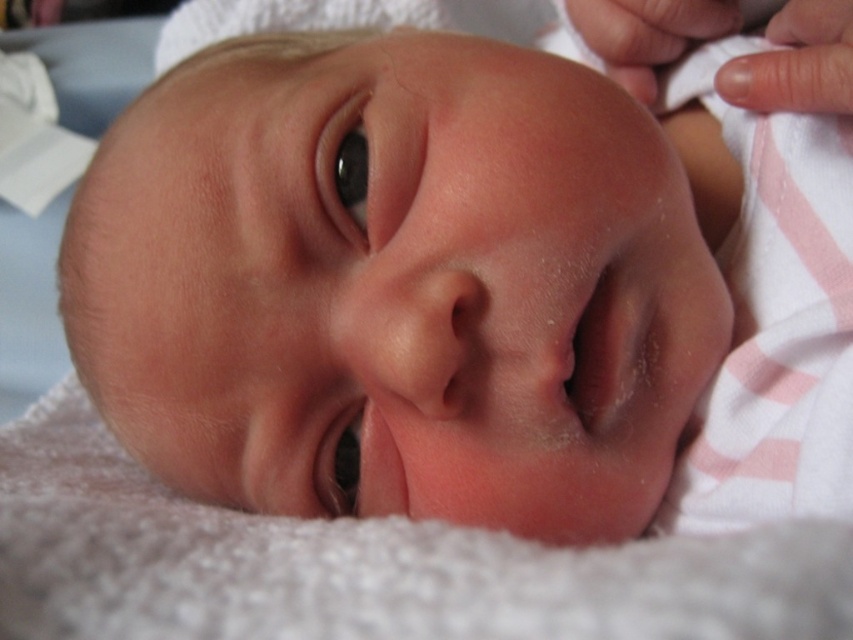
Can you confirm if black glossy eye at upper left is positioned to the left of black smooth eye at center?

In fact, black glossy eye at upper left is to the right of black smooth eye at center.

Can you confirm if black glossy eye at upper left is smaller than black smooth eye at center?

No.

The width and height of the screenshot is (853, 640). What do you see at coordinates (345, 168) in the screenshot?
I see `black glossy eye at upper left` at bounding box center [345, 168].

At what (x,y) coordinates should I click in order to perform the action: click on black glossy eye at upper left. Please return your answer as a coordinate pair (x, y). Image resolution: width=853 pixels, height=640 pixels. Looking at the image, I should click on (345, 168).